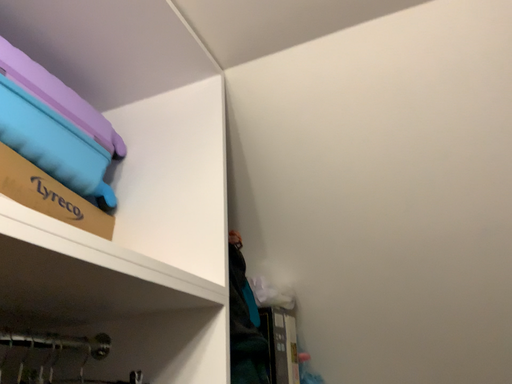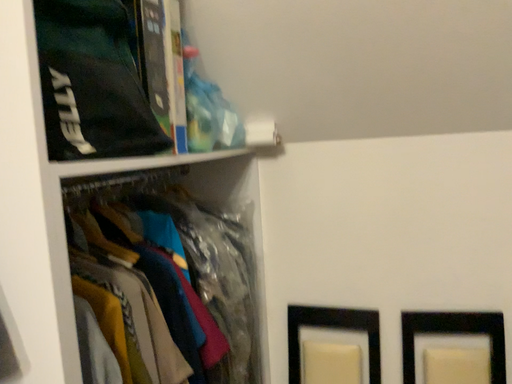
Question: How did the camera likely rotate when shooting the video?

Choices:
 (A) rotated upward
 (B) rotated downward

Answer: (B)